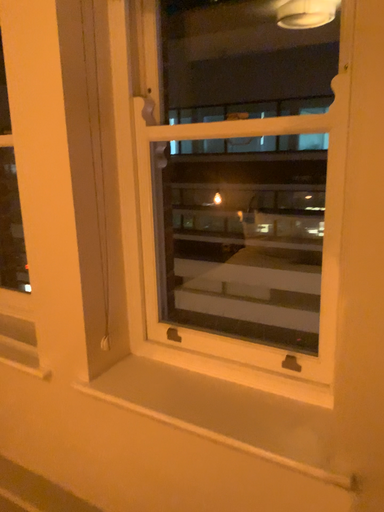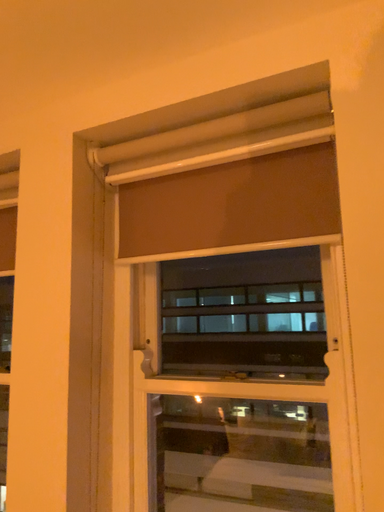
Question: How did the camera likely rotate when shooting the video?

Choices:
 (A) rotated upward
 (B) rotated downward

Answer: (A)